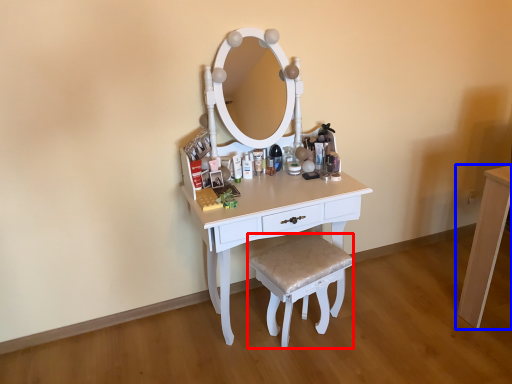
Question: Which of the following is the farthest to the observer, stool (highlighted by a red box) or table (highlighted by a blue box)?

Choices:
 (A) stool
 (B) table

Answer: (B)